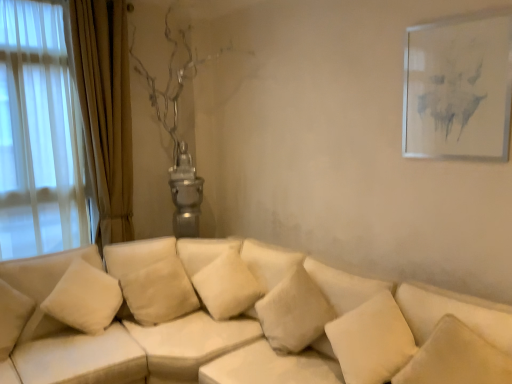
Question: Is soft beige cushion at center, the 3th pillow viewed from the left, positioned before white soft pillow at lower right, the second pillow from the right?

Choices:
 (A) no
 (B) yes

Answer: (A)

Question: Is soft beige cushion at center, which ranks as the third pillow in right-to-left order, next to white soft pillow at lower right, the second pillow from the right?

Choices:
 (A) no
 (B) yes

Answer: (A)

Question: Is soft beige cushion at center, which ranks as the third pillow in right-to-left order, far away from white soft pillow at lower right, placed as the fourth pillow when sorted from left to right?

Choices:
 (A) yes
 (B) no

Answer: (B)

Question: From a real-world perspective, is soft beige cushion at center, which ranks as the third pillow in right-to-left order, on white soft pillow at lower right, placed as the fourth pillow when sorted from left to right?

Choices:
 (A) yes
 (B) no

Answer: (B)

Question: Considering the relative sizes of soft beige cushion at center, which ranks as the third pillow in right-to-left order, and white soft pillow at lower right, the second pillow from the right, in the image provided, is soft beige cushion at center, which ranks as the third pillow in right-to-left order, taller than white soft pillow at lower right, the second pillow from the right,?

Choices:
 (A) yes
 (B) no

Answer: (A)

Question: Does soft beige cushion at center, which ranks as the third pillow in right-to-left order, have a greater width compared to white soft pillow at lower right, the second pillow from the right?

Choices:
 (A) no
 (B) yes

Answer: (B)

Question: Can you confirm if white soft pillow at center, arranged as the 1th pillow when viewed from the left, is positioned to the left of white soft pillow at lower right, placed as the fourth pillow when sorted from left to right?

Choices:
 (A) no
 (B) yes

Answer: (B)

Question: From a real-world perspective, is white soft pillow at center, acting as the 5th pillow starting from the right, physically below white soft pillow at lower right, placed as the fourth pillow when sorted from left to right?

Choices:
 (A) no
 (B) yes

Answer: (B)

Question: Does white soft pillow at center, acting as the 5th pillow starting from the right, lie in front of white soft pillow at lower right, placed as the fourth pillow when sorted from left to right?

Choices:
 (A) yes
 (B) no

Answer: (B)

Question: Considering the relative sizes of white soft pillow at center, acting as the 5th pillow starting from the right, and white soft pillow at lower right, placed as the fourth pillow when sorted from left to right, in the image provided, is white soft pillow at center, acting as the 5th pillow starting from the right, smaller than white soft pillow at lower right, placed as the fourth pillow when sorted from left to right,?

Choices:
 (A) yes
 (B) no

Answer: (B)

Question: Is white soft pillow at center, arranged as the 1th pillow when viewed from the left, bigger than white soft pillow at lower right, the second pillow from the right?

Choices:
 (A) yes
 (B) no

Answer: (A)

Question: Considering the relative sizes of white soft pillow at center, acting as the 5th pillow starting from the right, and white soft pillow at lower right, the second pillow from the right, in the image provided, is white soft pillow at center, acting as the 5th pillow starting from the right, wider than white soft pillow at lower right, the second pillow from the right,?

Choices:
 (A) no
 (B) yes

Answer: (A)

Question: Does soft beige cushion at center, which ranks as the third pillow in right-to-left order, come in front of white fabric couch at center?

Choices:
 (A) no
 (B) yes

Answer: (A)